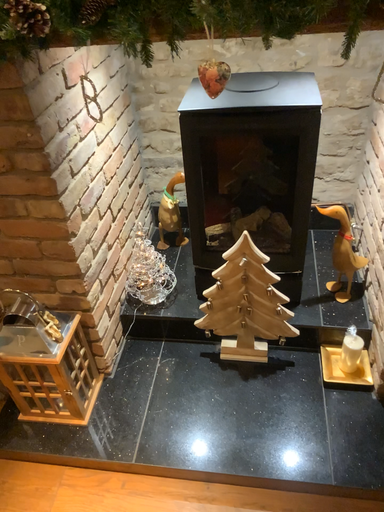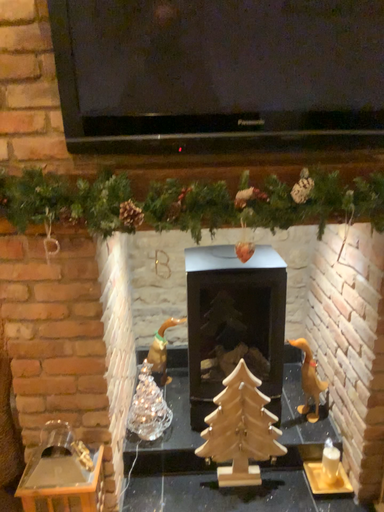
Question: How did the camera likely rotate when shooting the video?

Choices:
 (A) rotated upward
 (B) rotated downward

Answer: (A)